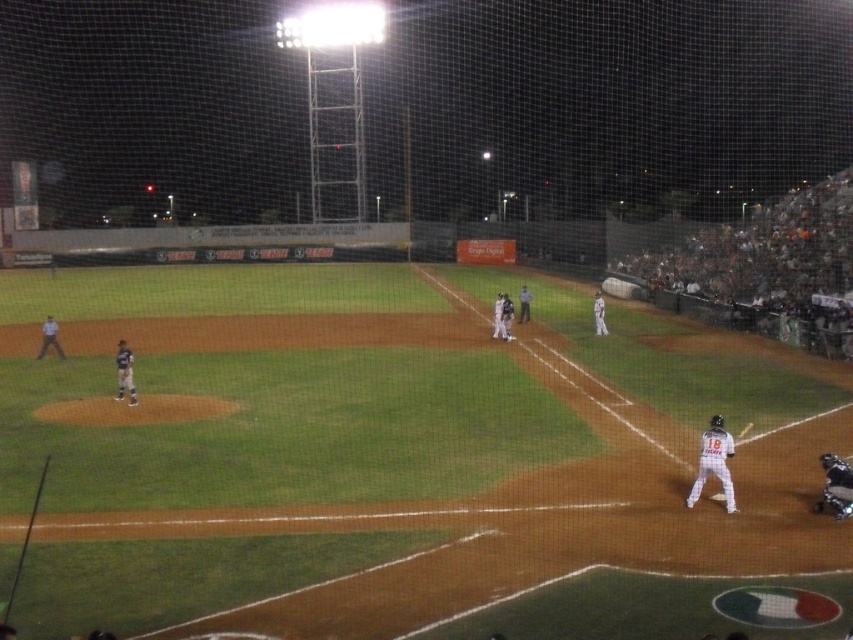
Measure the distance between white matte baseball player at upper right and camera.

white matte baseball player at upper right is 23.89 meters away from camera.

The width and height of the screenshot is (853, 640). I want to click on white matte baseball player at upper right, so click(763, 269).

Can you confirm if metallic silver helmet at lower right is positioned to the right of yellow wood bat at lower right?

Incorrect, metallic silver helmet at lower right is not on the right side of yellow wood bat at lower right.

Which is behind, point (822, 493) or point (744, 435)?

Point (744, 435)

Does point (850, 468) come closer to viewer compared to point (740, 433)?

Yes, point (850, 468) is in front of point (740, 433).

The width and height of the screenshot is (853, 640). In order to click on metallic silver helmet at lower right in this screenshot , I will do `click(836, 484)`.

How far apart are white matte uniform at lower right and metallic silver helmet at lower right?

white matte uniform at lower right is 4.63 feet away from metallic silver helmet at lower right.

Can you confirm if white matte uniform at lower right is thinner than metallic silver helmet at lower right?

No, white matte uniform at lower right is not thinner than metallic silver helmet at lower right.

Who is more distant from viewer, (703, 467) or (831, 502)?

Positioned behind is point (703, 467).

Identify the location of white matte uniform at lower right. (714, 461).